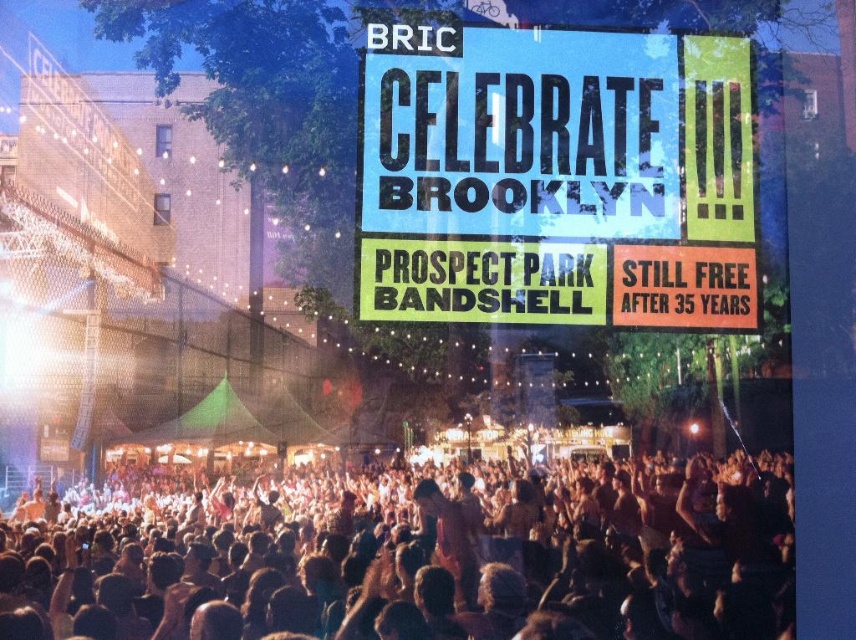
Does human flesh at center appear on the right side of blue paper sign at upper center?

No, human flesh at center is not to the right of blue paper sign at upper center.

How distant is human flesh at center from blue paper sign at upper center?

They are 17.58 meters apart.

At what (x,y) coordinates should I click in order to perform the action: click on human flesh at center. Please return your answer as a coordinate pair (x, y). Looking at the image, I should click on (412, 556).